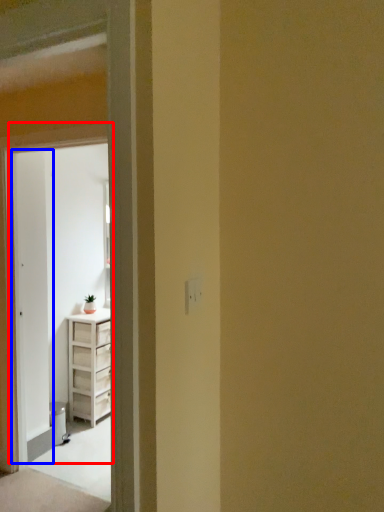
Question: Which object is closer to the camera taking this photo, door (highlighted by a red box) or screen door (highlighted by a blue box)?

Choices:
 (A) door
 (B) screen door

Answer: (A)